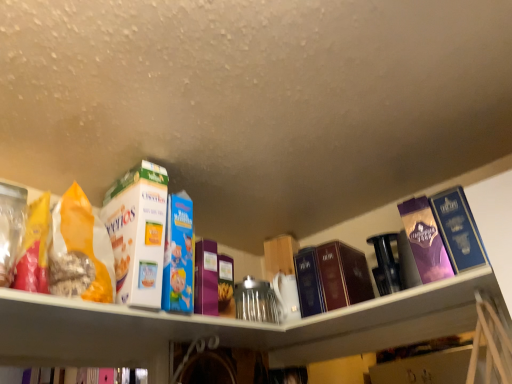
Question: Is matte orange bag of cereal at left in front of or behind white cardboard cereal box at upper left, which is the 7th book in right-to-left order, in the image?

Choices:
 (A) front
 (B) behind

Answer: (A)

Question: Is matte orange bag of cereal at left taller or shorter than white cardboard cereal box at upper left, the second book when ordered from left to right?

Choices:
 (A) short
 (B) tall

Answer: (A)

Question: Which of these objects is positioned closest to the purple cardboard book at center, the 4th book positioned from the left?

Choices:
 (A) dark blue hardcover book at center, arranged as the sixth book when viewed from the left
 (B) hardcover book at center, which is counted as the 5th book, starting from the left
 (C) matte orange bag of cereal at left
 (D) blue cardboard cereal box at center, marked as the sixth book in a right-to-left arrangement
 (E) purple glossy book at upper right, which appears as the seventh book when viewed from the left

Answer: (D)

Question: Considering the real-world distances, which object is closest to the dark blue hardcover book at center, the third book when ordered from right to left?

Choices:
 (A) white cardboard cereal box at upper left, which is the 7th book in right-to-left order
 (B) purple glossy book at upper right, which appears as the seventh book when viewed from the left
 (C) purple glossy book at upper right, the 8th book from the left
 (D) matte orange bag of cereal at left
 (E) purple cardboard book at center, the 4th book positioned from the left

Answer: (B)